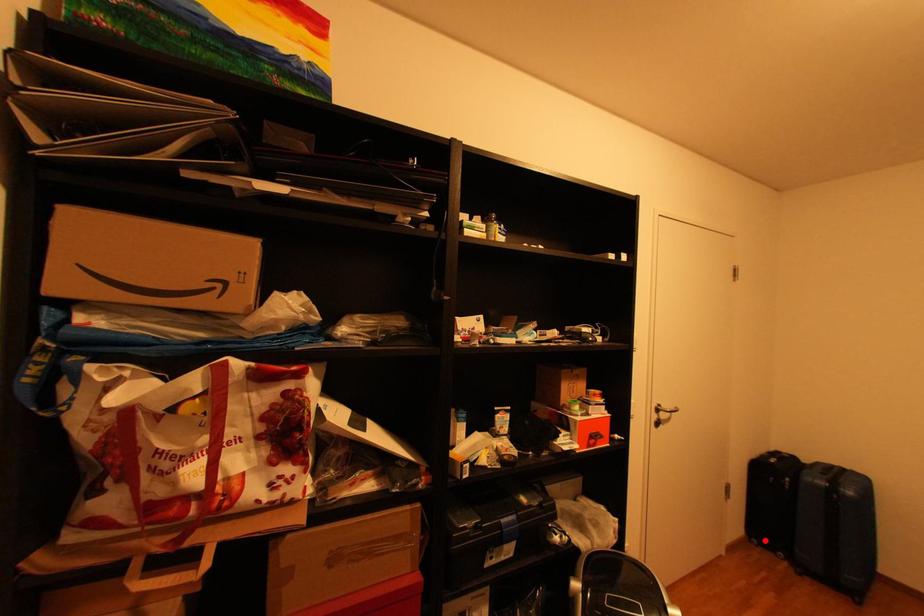
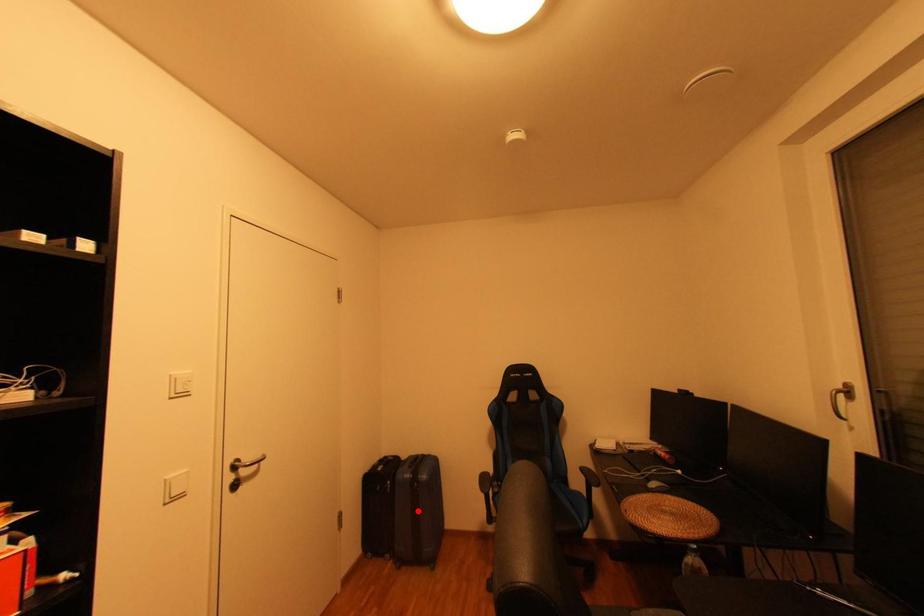
I am providing you with two images of the same scene from different viewpoints. A red point is marked on the first image and another point is marked on the second image. Do the highlighted points in image1 and image2 indicate the same real-world spot?

No